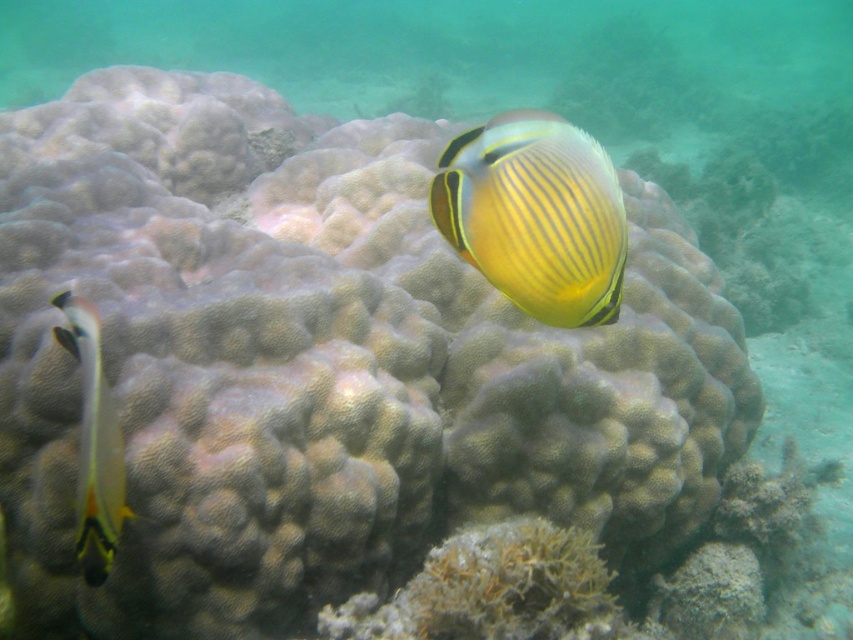
Who is positioned more to the right, yellow striped fish at center or translucent yellow and black fish at left?

yellow striped fish at center is more to the right.

Does yellow striped fish at center have a greater width compared to translucent yellow and black fish at left?

No, yellow striped fish at center is not wider than translucent yellow and black fish at left.

The width and height of the screenshot is (853, 640). In order to click on yellow striped fish at center in this screenshot , I will do `click(535, 216)`.